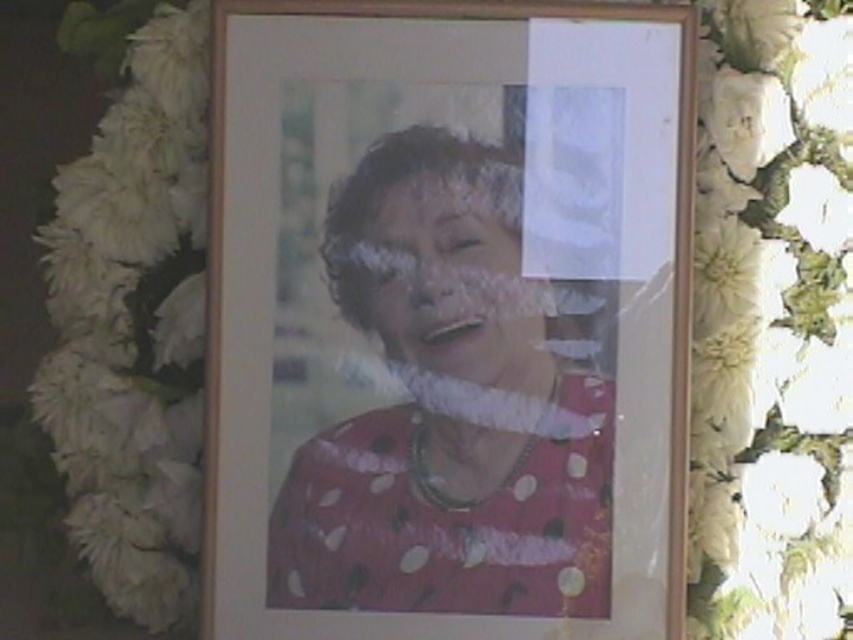
Is the position of white fluffy petals at left less distant than that of matte pink lips at center?

No, it is not.

Is white fluffy petals at left thinner than matte pink lips at center?

Incorrect, white fluffy petals at left's width is not less than matte pink lips at center's.

What are the coordinates of `white fluffy petals at left` in the screenshot? It's located at (132, 310).

Based on the photo, who is more forward, (x=519, y=376) or (x=433, y=340)?

Point (x=519, y=376) is more forward.

Is point (390, 308) positioned before point (450, 323)?

Yes.

Is point (508, 330) more distant than point (422, 324)?

No, it is not.

Locate an element on the screen. This screenshot has height=640, width=853. matte pink polka dot dress at center is located at coordinates (451, 285).

This screenshot has width=853, height=640. In order to click on white fluffy petals at right in this screenshot , I will do `click(770, 324)`.

Which is more to the left, white fluffy petals at right or white fluffy petals at left?

white fluffy petals at left

Is point (791, 589) behind point (169, 440)?

No, (791, 589) is in front of (169, 440).

What are the coordinates of `white fluffy petals at right` in the screenshot? It's located at (770, 324).